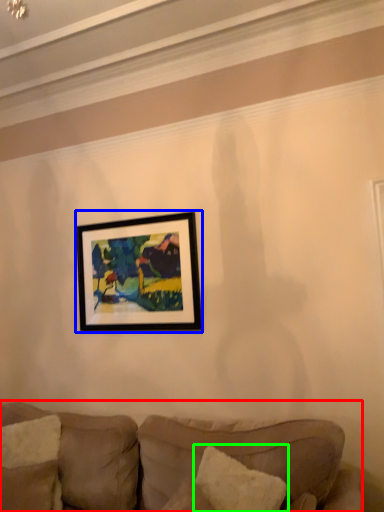
Question: Estimate the real-world distances between objects in this image. Which object is closer to studio couch (highlighted by a red box), picture frame (highlighted by a blue box) or pillow (highlighted by a green box)?

Choices:
 (A) picture frame
 (B) pillow

Answer: (B)